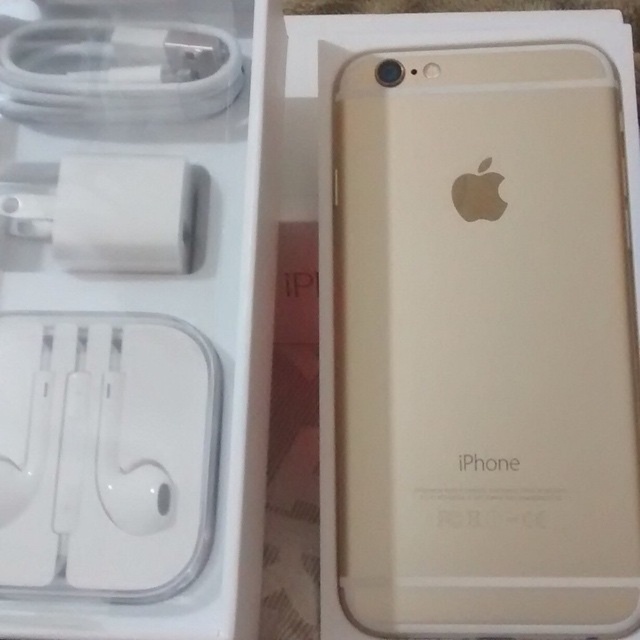
Question: Does gold matte iphone at center appear over white matte earphones at left?

Choices:
 (A) no
 (B) yes

Answer: (B)

Question: Which object appears farthest from the camera in this image?

Choices:
 (A) white matte earphones at left
 (B) gold matte iphone at center

Answer: (B)

Question: Can you confirm if gold matte iphone at center is bigger than white matte earphones at left?

Choices:
 (A) yes
 (B) no

Answer: (A)

Question: In this image, where is gold matte iphone at center located relative to white matte earphones at left?

Choices:
 (A) right
 (B) left

Answer: (A)

Question: Which of the following is the farthest from the observer?

Choices:
 (A) (579, 368)
 (B) (134, 500)

Answer: (A)